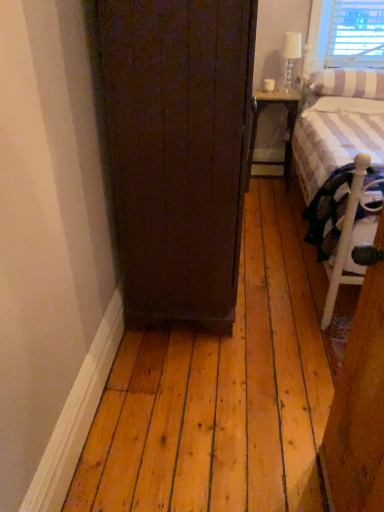
Question: Is striped fabric pillow at upper right wider than metallic gray nightstand at right?

Choices:
 (A) yes
 (B) no

Answer: (A)

Question: Does striped fabric pillow at upper right have a lesser height compared to metallic gray nightstand at right?

Choices:
 (A) no
 (B) yes

Answer: (B)

Question: From the image's perspective, does striped fabric pillow at upper right appear lower than metallic gray nightstand at right?

Choices:
 (A) no
 (B) yes

Answer: (A)

Question: Is striped fabric pillow at upper right behind metallic gray nightstand at right?

Choices:
 (A) yes
 (B) no

Answer: (B)

Question: Does striped fabric pillow at upper right turn towards metallic gray nightstand at right?

Choices:
 (A) no
 (B) yes

Answer: (A)

Question: Is striped fabric pillow at upper right closer to camera compared to metallic gray nightstand at right?

Choices:
 (A) no
 (B) yes

Answer: (B)

Question: Is white glass lamp at upper right placed right next to metallic gray nightstand at right?

Choices:
 (A) yes
 (B) no

Answer: (B)

Question: Can you confirm if white glass lamp at upper right is thinner than metallic gray nightstand at right?

Choices:
 (A) yes
 (B) no

Answer: (A)

Question: Is white glass lamp at upper right not close to metallic gray nightstand at right?

Choices:
 (A) yes
 (B) no

Answer: (B)

Question: From the image's perspective, does white glass lamp at upper right appear lower than metallic gray nightstand at right?

Choices:
 (A) no
 (B) yes

Answer: (A)

Question: From a real-world perspective, is white glass lamp at upper right on metallic gray nightstand at right?

Choices:
 (A) yes
 (B) no

Answer: (A)

Question: Is metallic gray nightstand at right located within white glass lamp at upper right?

Choices:
 (A) yes
 (B) no

Answer: (B)

Question: Considering the relative positions of striped fabric pillow at upper right and white striped fabric at right in the image provided, is striped fabric pillow at upper right behind white striped fabric at right?

Choices:
 (A) no
 (B) yes

Answer: (B)